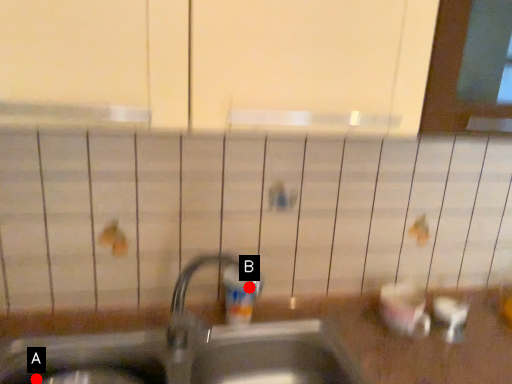
Question: Two points are circled on the image, labeled by A and B beside each circle. Which point appears farthest from the camera in this image?

Choices:
 (A) A is further
 (B) B is further

Answer: (B)